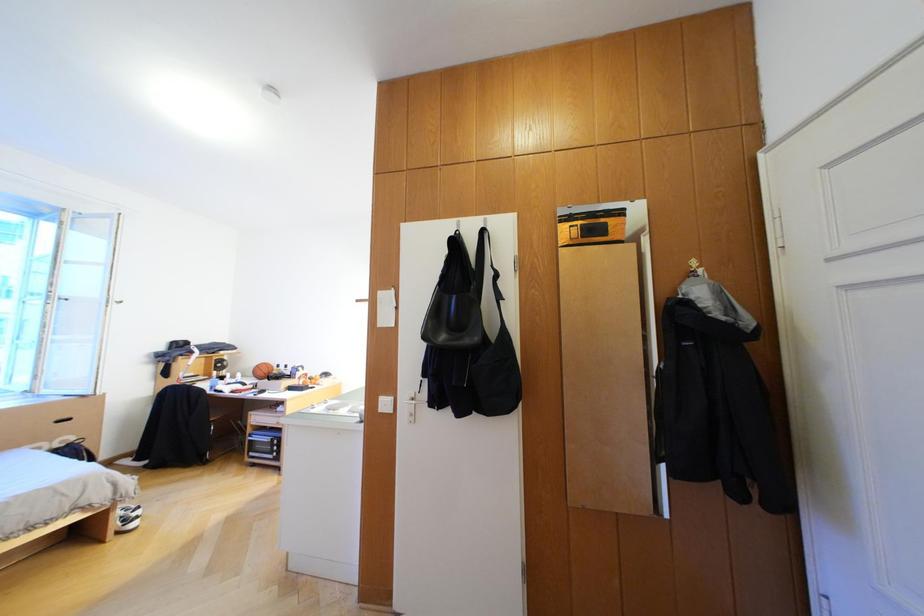
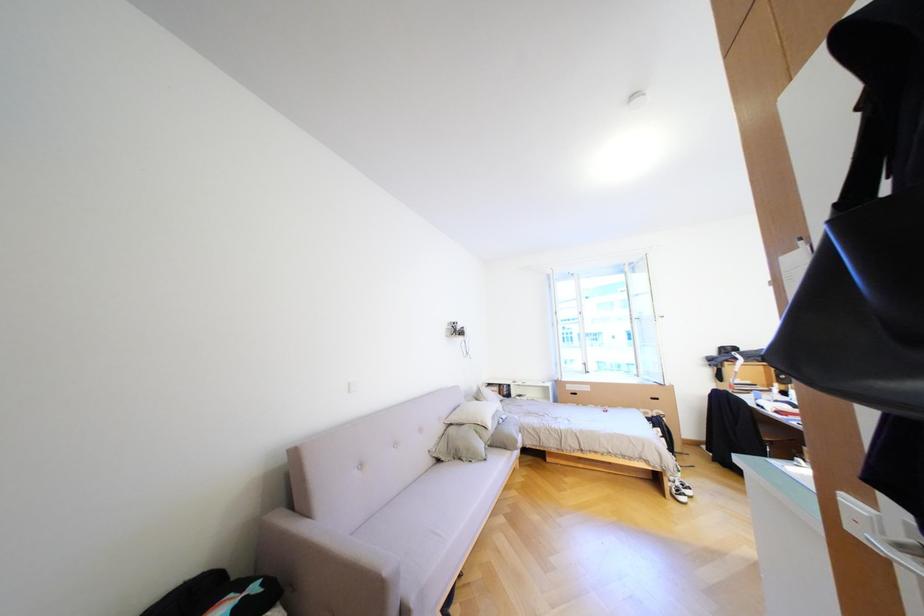
Question: The images are taken continuously from a first-person perspective. In which direction is your viewpoint rotating?

Choices:
 (A) Left
 (B) Right
 (C) Up
 (D) Down

Answer: (A)